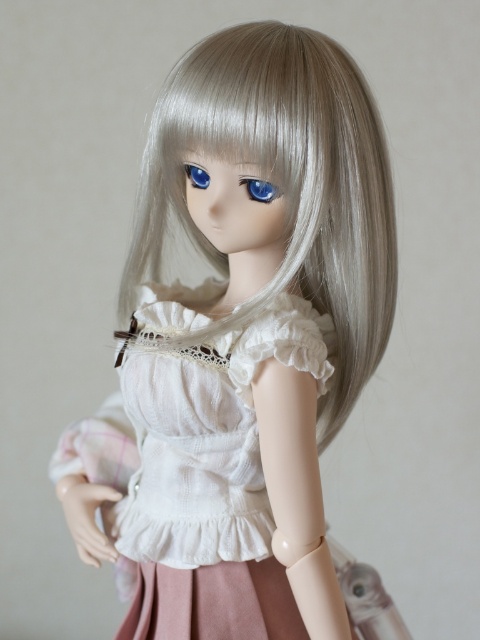
Question: Does matte white dress at center have a greater width compared to white lace dress at center?

Choices:
 (A) no
 (B) yes

Answer: (B)

Question: Which is farther from the matte white dress at center?

Choices:
 (A) blue glossy eye at center
 (B) white lace dress at center

Answer: (A)

Question: Is white lace dress at center below blue glossy eye at upper center?

Choices:
 (A) yes
 (B) no

Answer: (A)

Question: Which point appears farthest from the camera in this image?

Choices:
 (A) (200, 172)
 (B) (206, 529)

Answer: (B)

Question: Does white lace dress at center lie in front of blue glossy eye at center?

Choices:
 (A) yes
 (B) no

Answer: (A)

Question: Which of the following is the farthest from the observer?

Choices:
 (A) (195, 166)
 (B) (266, 196)

Answer: (A)